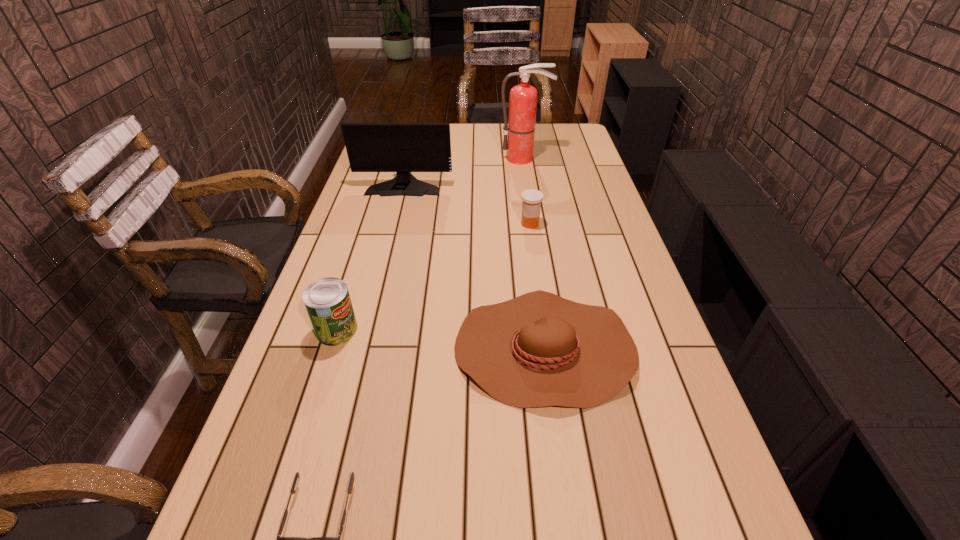
The image size is (960, 540). In order to click on blank space located on the front of the can in this screenshot , I will do `click(281, 505)`.

This screenshot has height=540, width=960. I want to click on blank area located 0.310m on the label of the medicine, so click(x=425, y=224).

The width and height of the screenshot is (960, 540). In order to click on blank space located 0.050m on the label of the medicine in this screenshot , I will do `click(504, 224)`.

Locate an element on the screen. The width and height of the screenshot is (960, 540). vacant space located 0.370m on the label of the medicine is located at coordinates (407, 224).

Locate an element on the screen. vacant space located on the left of the cowboy hat is located at coordinates (310, 349).

This screenshot has width=960, height=540. Find the location of `monitor positioned at the left edge`. monitor positioned at the left edge is located at coordinates (371, 147).

Where is `can at the left edge`? This screenshot has height=540, width=960. can at the left edge is located at coordinates (327, 300).

This screenshot has height=540, width=960. Find the location of `object present at the right edge`. object present at the right edge is located at coordinates (537, 350).

Find the location of a particular element. Image resolution: width=960 pixels, height=540 pixels. free space at the far edge of the desktop is located at coordinates (462, 124).

Identify the location of free region at the left edge. (363, 216).